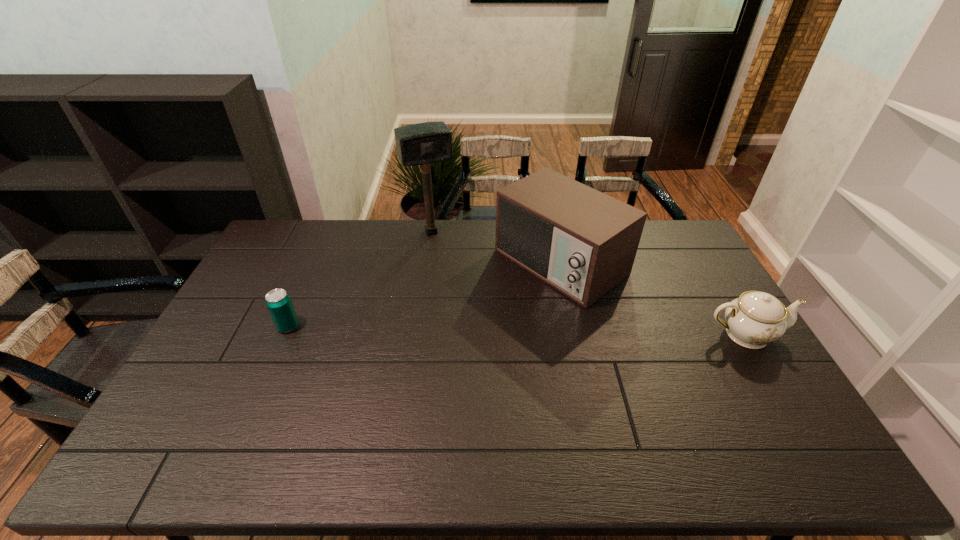
I want to click on blank area located 0.200m on the front-facing side of the second tallest object, so click(470, 322).

The width and height of the screenshot is (960, 540). What are the coordinates of `vacant space situated on the front-facing side of the second tallest object` in the screenshot? It's located at (505, 299).

Where is `vacant space located on the head of the second object from left to right`? vacant space located on the head of the second object from left to right is located at coordinates (460, 284).

This screenshot has width=960, height=540. I want to click on free spot located 0.120m on the head of the second object from left to right, so click(448, 261).

Locate an element on the screen. The width and height of the screenshot is (960, 540). free region located 0.110m on the head of the second object from left to right is located at coordinates (447, 259).

I want to click on radio receiver that is at the far edge, so click(x=582, y=242).

Identify the location of mallet situated at the far edge. Image resolution: width=960 pixels, height=540 pixels. (424, 143).

Locate an element on the screen. object that is at the right edge is located at coordinates (753, 320).

Image resolution: width=960 pixels, height=540 pixels. Find the location of `blank area at the far edge`. blank area at the far edge is located at coordinates (353, 220).

Find the location of a particular element. This screenshot has width=960, height=540. free region at the near edge is located at coordinates (610, 415).